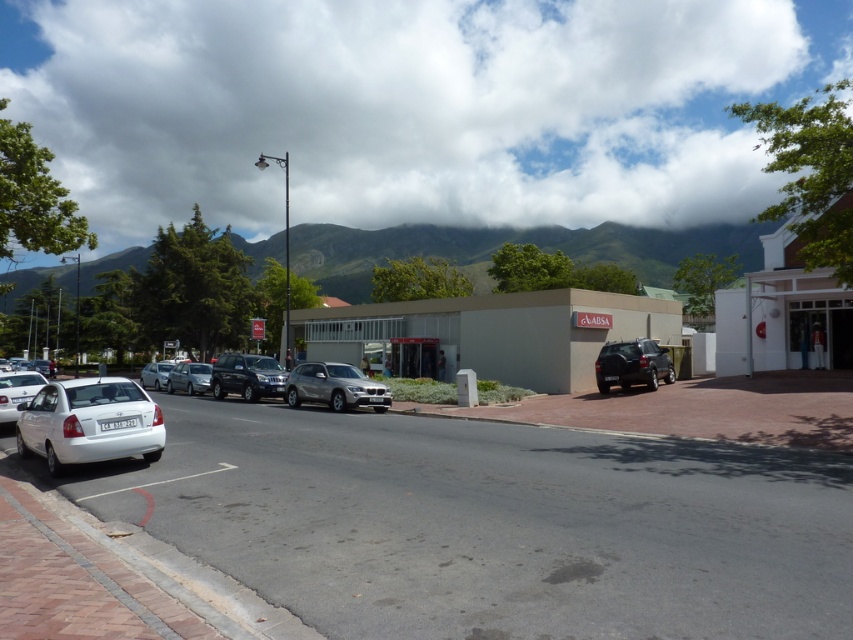
You are standing at the camera position and want to walk to the point labeled point (x=415, y=419). There is also another point labeled point (x=155, y=364) in the scene. Which point will you reach first if you walk straight towards them?

You will reach point (x=415, y=419) first because it is closer to the camera than point (x=155, y=364).

You are standing on the street and want to walk from point [378,234] to point [206,365]. Which direction should you move relative to your current position?

You should move away from the viewer since point [206,365] is further away than point [378,234].

You are standing at the entrance of the ABSA building on the right side of the image. You need to walk to the smooth asphalt parking lot at center. In which general direction should you head?

The smooth asphalt parking lot at center is located at point (492, 524), so you should head towards the center of the image from the ABSA building on the right side.